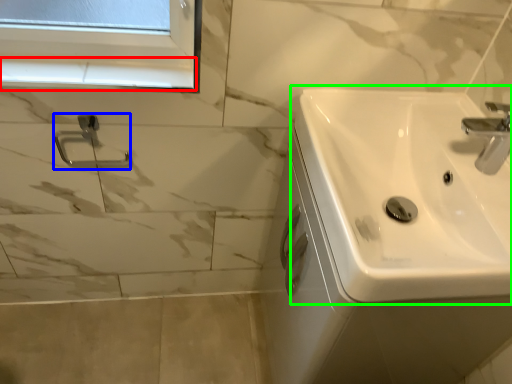
Question: Which object is positioned closest to window sill (highlighted by a red box)? Select from shower (highlighted by a blue box) and sink (highlighted by a green box).

Choices:
 (A) shower
 (B) sink

Answer: (A)